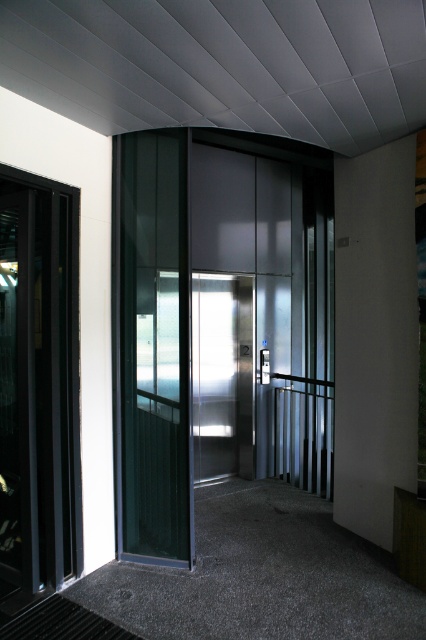
Question: Is satin silver elevator at center wider than transparent glass elevator at center?

Choices:
 (A) yes
 (B) no

Answer: (A)

Question: Observing the image, what is the correct spatial positioning of satin silver elevator at center in reference to transparent glass elevator at center?

Choices:
 (A) left
 (B) right

Answer: (B)

Question: Which of the following is the closest to the observer?

Choices:
 (A) (271, 387)
 (B) (140, 477)

Answer: (B)

Question: Which object is closer to the camera taking this photo?

Choices:
 (A) satin silver elevator at center
 (B) transparent glass elevator at center

Answer: (B)

Question: Is the position of satin silver elevator at center more distant than that of transparent glass elevator at center?

Choices:
 (A) no
 (B) yes

Answer: (B)